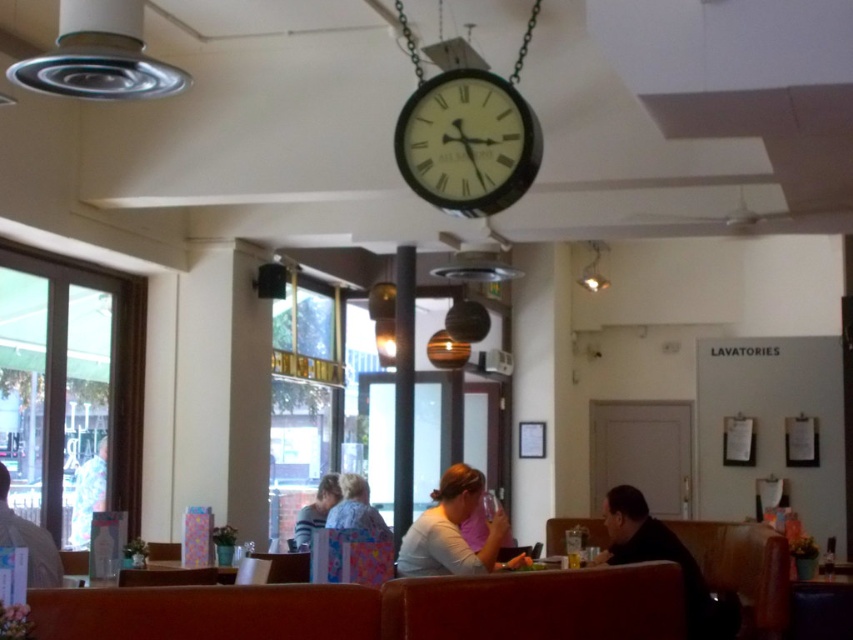
You are taking a photo of the dining establishment and want to focus on both point (437, 164) and point (408, 548). Since you can only focus on one point at a time, which point should you choose to ensure both are in focus?

You should focus on point (408, 548) because it is further away from the camera than point (437, 164). By focusing on the further point, both points will be in focus due to the depth of field.

You are a customer sitting at the table in the center of the dining area. You notice the metallic silver clock at upper center and the matte white shirt at center. Which object is positioned to the left from your perspective?

The metallic silver clock at upper center is to the left of the matte white shirt at center.

You are a customer sitting at a table in the dining establishment. You notice a metallic silver clock at upper center located at point (467,141). Where would you look to see the clock from your current position?

The metallic silver clock at upper center is located at point (467,141), so you should look towards the upper center direction to see it.